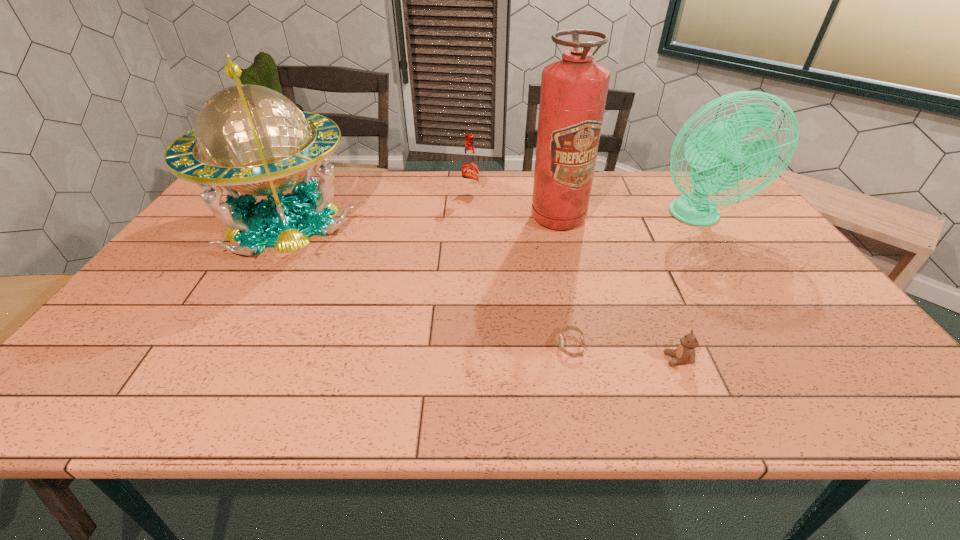
I want to click on fan at the far edge, so click(715, 149).

Identify the location of root beer that is at the far edge. (469, 168).

Locate an element on the screen. object that is positioned at the left edge is located at coordinates 251,139.

Where is `object situated at the right edge`? object situated at the right edge is located at coordinates (715, 149).

Locate an element on the screen. The width and height of the screenshot is (960, 540). object at the far left corner is located at coordinates (251, 139).

Locate an element on the screen. This screenshot has height=540, width=960. object that is at the far right corner is located at coordinates (715, 149).

Identify the location of free space at the far edge of the desktop. Image resolution: width=960 pixels, height=540 pixels. (346, 198).

In the image, there is a desktop. Where is `vacant space at the near edge`? The width and height of the screenshot is (960, 540). vacant space at the near edge is located at coordinates (632, 382).

Where is `vacant space at the right edge`? vacant space at the right edge is located at coordinates (790, 314).

In the image, there is a desktop. Identify the location of free space at the far right corner. (726, 196).